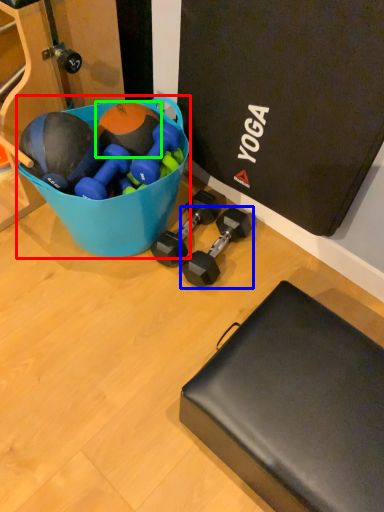
Question: Based on their relative distances, which object is nearer to bowl (highlighted by a red box)? Choose from dumbbell (highlighted by a blue box) and sports equipment (highlighted by a green box).

Choices:
 (A) dumbbell
 (B) sports equipment

Answer: (B)